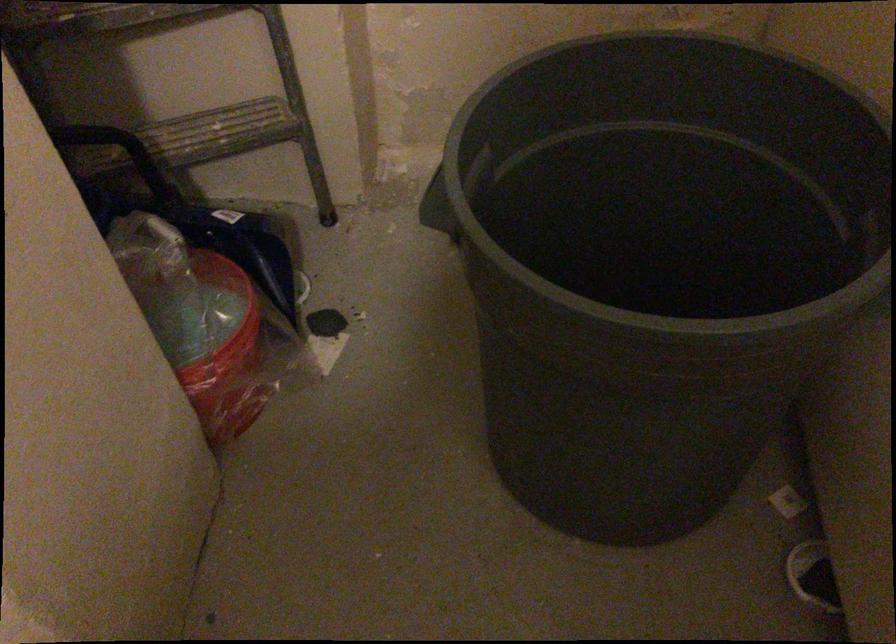
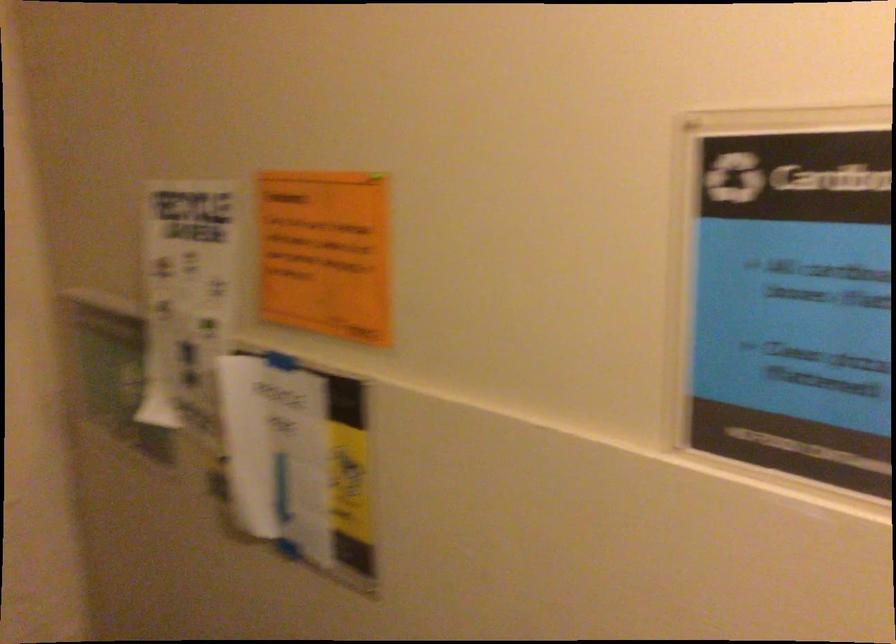
Based on the continuous images, in which direction is the camera rotating?

The rotation direction of the camera is right-up.